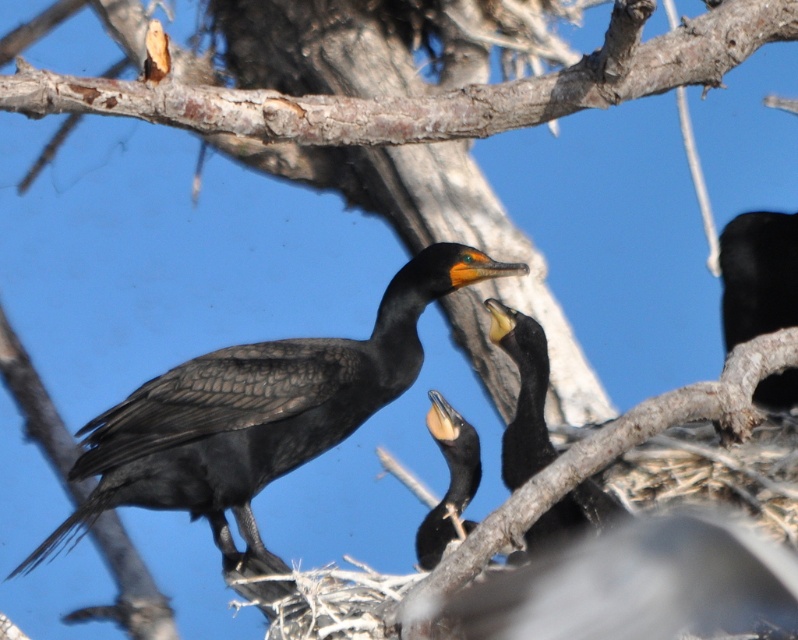
You are a bird with a wingspan of 3 feet. You want to fly from the smooth bark branch at upper center to the black matte bird at center. Can you make the jump without flapping your wings? Please explain your reasoning.

The distance between the smooth bark branch at upper center and the black matte bird at center is 4.84 feet. Since your wingspan is 3 feet, you cannot jump the distance without flapping your wings because the distance is greater than your wingspan.

You are a birdwatcher observing the scene. You notice the smooth bark branch at upper center and the black matte bird at center. Which object is shorter in height?

The smooth bark branch at upper center is shorter in height than the black matte bird at center, as the branch is not as tall as the bird.